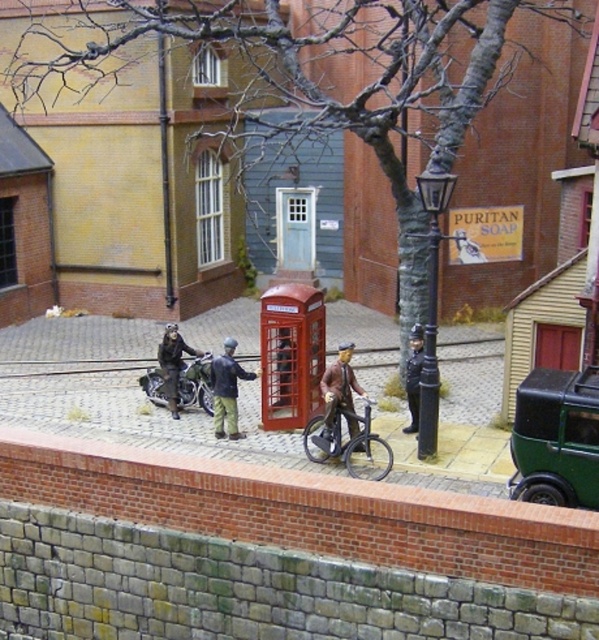
Question: Is red plastic phone box at center positioned before dark brown leather jacket at center?

Choices:
 (A) no
 (B) yes

Answer: (A)

Question: Does shiny silver bicycle at center lie in front of brown leather jacket at center?

Choices:
 (A) no
 (B) yes

Answer: (B)

Question: Which of the following is the closest to the observer?

Choices:
 (A) (317, 452)
 (B) (413, 337)
 (C) (176, 323)

Answer: (A)

Question: Which object is closer to the camera taking this photo?

Choices:
 (A) shiny silver bicycle at center
 (B) metallic red telephone booth at center
 (C) matte brown leather jacket at center
 (D) brown leather jacket at center

Answer: (A)

Question: Among these objects, which one is farthest from the camera?

Choices:
 (A) shiny metallic bicycle at center
 (B) green matte car at lower right

Answer: (A)

Question: Does matte brown leather jacket at center appear on the left side of dark brown leather jacket at center?

Choices:
 (A) no
 (B) yes

Answer: (B)